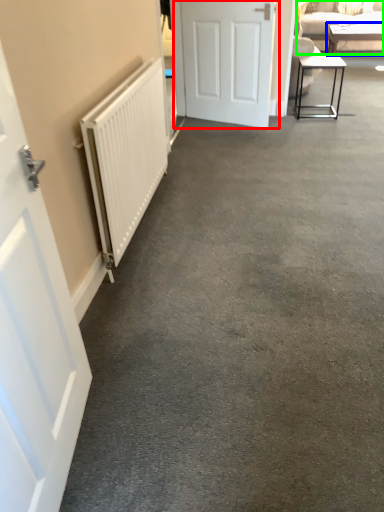
Question: Which object is the closest to the door (highlighted by a red box)? Choose among these: table (highlighted by a blue box) or studio couch (highlighted by a green box).

Choices:
 (A) table
 (B) studio couch

Answer: (B)